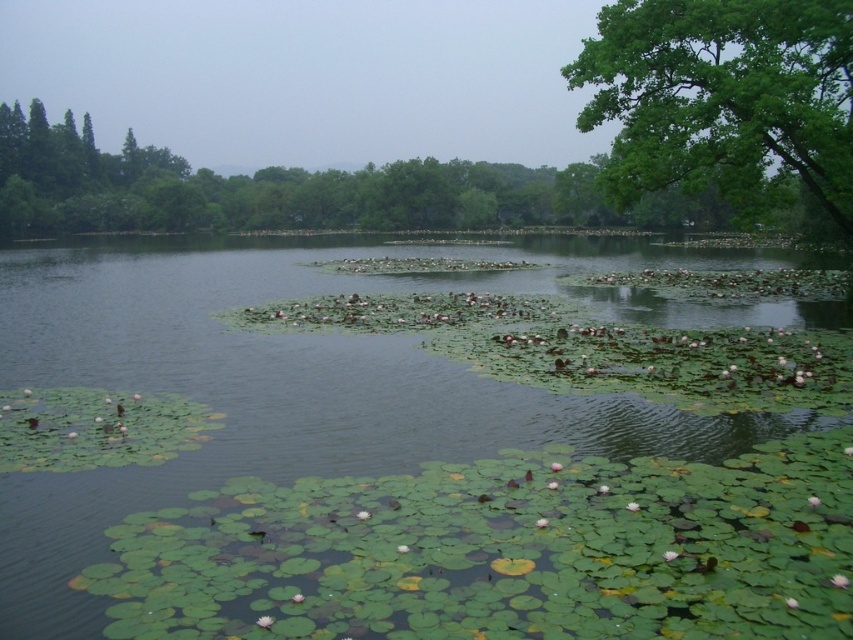
Question: Among these objects, which one is nearest to the camera?

Choices:
 (A) green leafy tree at upper right
 (B) green leafy water at center

Answer: (B)

Question: Does green leafy water at center appear over green leafy tree at upper right?

Choices:
 (A) no
 (B) yes

Answer: (A)

Question: Is green leafy water at center thinner than green leafy tree at upper right?

Choices:
 (A) no
 (B) yes

Answer: (A)

Question: Observing the image, what is the correct spatial positioning of green leafy water at center in reference to green leafy tree at upper right?

Choices:
 (A) right
 (B) left

Answer: (B)

Question: Which point is closer to the camera?

Choices:
 (A) green leafy water at center
 (B) green leafy tree at upper right

Answer: (A)